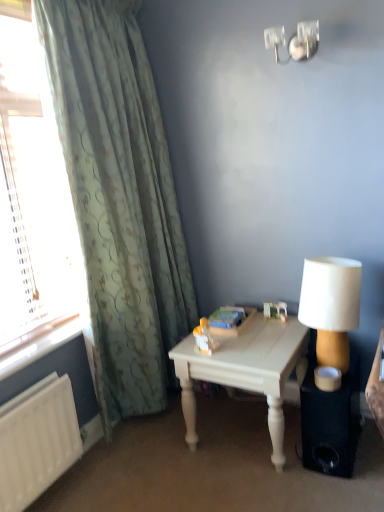
At what (x,y) coordinates should I click in order to perform the action: click on empty space that is ontop of white fabric lampshade at right (from a real-world perspective). Please return your answer as a coordinate pair (x, y). The image size is (384, 512). Looking at the image, I should click on (329, 262).